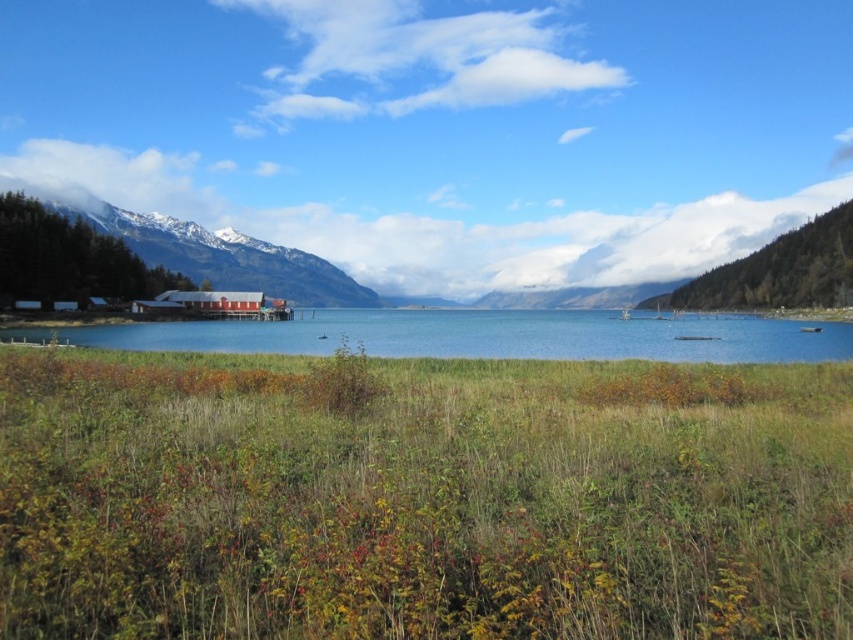
What do you see at coordinates (480, 336) in the screenshot? This screenshot has width=853, height=640. I see `blue water at center` at bounding box center [480, 336].

Can you confirm if blue water at center is taller than snowy mountain at left?

In fact, blue water at center may be shorter than snowy mountain at left.

Describe the element at coordinates (480, 336) in the screenshot. The height and width of the screenshot is (640, 853). I see `blue water at center` at that location.

Where is `blue water at center`? The width and height of the screenshot is (853, 640). blue water at center is located at coordinates (480, 336).